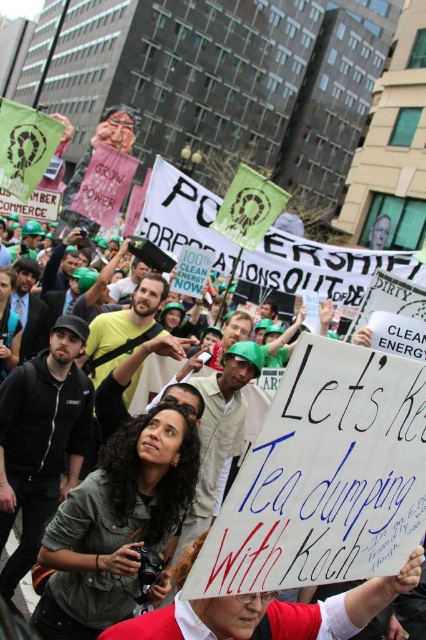
In the protest scene, you notice a white paper sign at center and a matte black jacket at center. From your perspective, which object is positioned to the right?

The white paper sign at center is to the right of the matte black jacket at center.